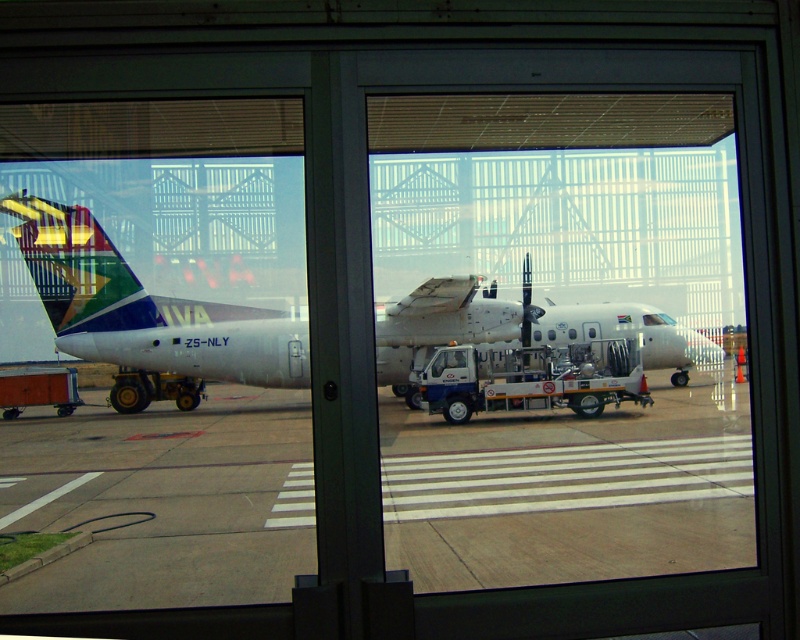
Question: Does transparent glass door at center have a greater width compared to white matte airplane at center?

Choices:
 (A) yes
 (B) no

Answer: (B)

Question: Among these points, which one is nearest to the camera?

Choices:
 (A) (605, 360)
 (B) (729, 522)

Answer: (B)

Question: Can you confirm if transparent glass door at center is bigger than white matte airplane at center?

Choices:
 (A) no
 (B) yes

Answer: (A)

Question: Which object appears closest to the camera in this image?

Choices:
 (A) white matte airplane at center
 (B) transparent glass door at center

Answer: (A)

Question: Does transparent glass door at center appear over white matte airplane at center?

Choices:
 (A) no
 (B) yes

Answer: (B)